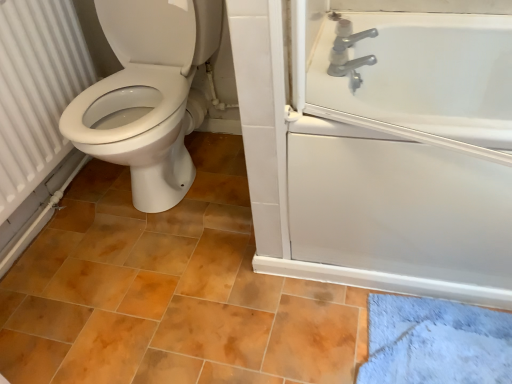
At what (x,y) coordinates should I click in order to perform the action: click on free space in front of silver metallic faucet at upper right. Please return your answer as a coordinate pair (x, y). Looking at the image, I should click on (344, 109).